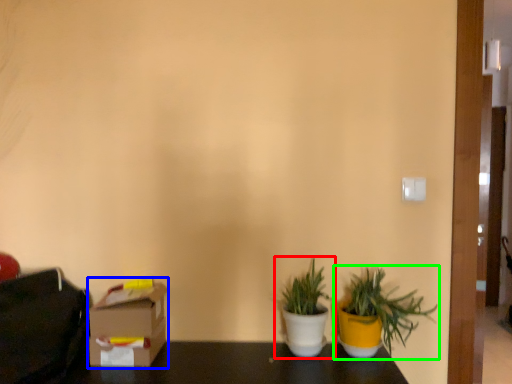
Question: Which object is positioned closest to houseplant (highlighted by a red box)? Select from cardboard box (highlighted by a blue box) and houseplant (highlighted by a green box).

Choices:
 (A) cardboard box
 (B) houseplant

Answer: (B)